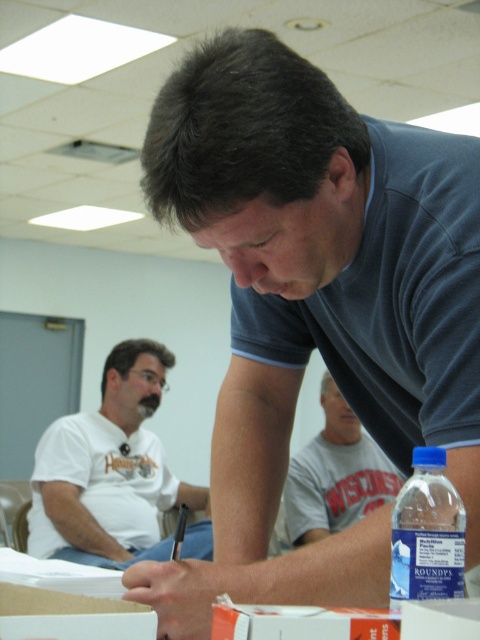
Question: Which point is closer to the camera?

Choices:
 (A) (316, 481)
 (B) (441, 531)

Answer: (B)

Question: Which of these objects is positioned closest to the white matte t-shirt at lower left?

Choices:
 (A) blue plastic water bottle at lower right
 (B) white cotton t-shirt at center
 (C) dark blue shirt at center

Answer: (B)

Question: Can you confirm if dark blue shirt at center is smaller than white matte t-shirt at lower left?

Choices:
 (A) yes
 (B) no

Answer: (A)

Question: Where is white matte t-shirt at lower left located in relation to white cotton t-shirt at center in the image?

Choices:
 (A) below
 (B) above

Answer: (A)

Question: Can you confirm if dark blue shirt at center is positioned to the left of blue plastic water bottle at lower right?

Choices:
 (A) yes
 (B) no

Answer: (A)

Question: Considering the real-world distances, which object is farthest from the white matte t-shirt at lower left?

Choices:
 (A) white cotton t-shirt at center
 (B) dark blue shirt at center

Answer: (B)